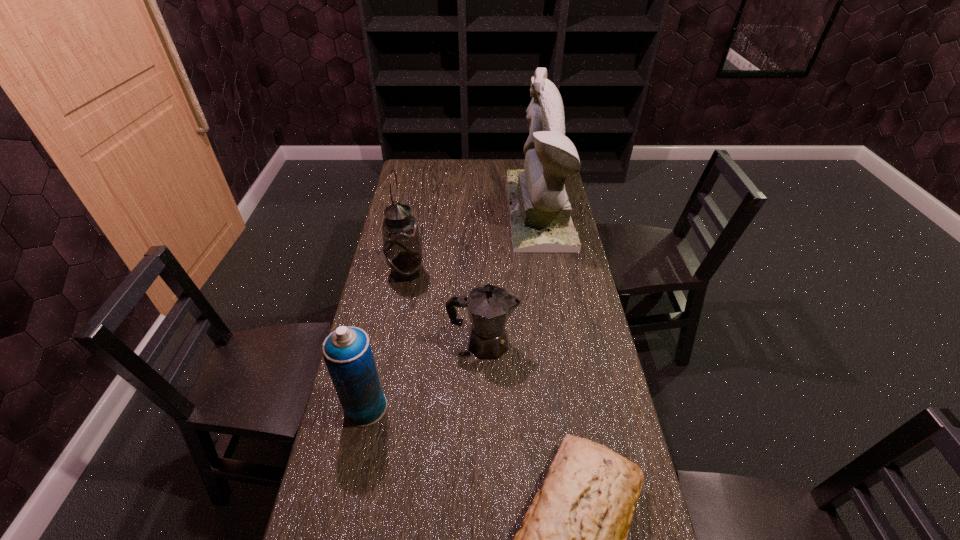
The height and width of the screenshot is (540, 960). I want to click on vacant point located on the base of the tallest object, so click(440, 210).

You are a GUI agent. You are given a task and a screenshot of the screen. Output one action in this format:
    pyautogui.click(x=<x>, y=<y>)
    Task: Click on the vacant area situated 0.210m on the back of the second farthest object
    This screenshot has width=960, height=540.
    Given the screenshot: What is the action you would take?
    pyautogui.click(x=414, y=226)

Identify the location of vacant space positioned 0.190m on the front of the second nearest object. This screenshot has width=960, height=540. (346, 504).

Where is `vacant region located 0.100m on the pouring side of the second shortest object`? Image resolution: width=960 pixels, height=540 pixels. vacant region located 0.100m on the pouring side of the second shortest object is located at coordinates (551, 343).

Locate an element on the screen. The width and height of the screenshot is (960, 540). object positioned at the far edge is located at coordinates (540, 212).

At what (x,y) coordinates should I click in order to perform the action: click on oil lamp located in the left edge section of the desktop. Please return your answer as a coordinate pair (x, y). This screenshot has height=540, width=960. Looking at the image, I should click on (401, 246).

You are a GUI agent. You are given a task and a screenshot of the screen. Output one action in this format:
    pyautogui.click(x=<x>, y=<y>)
    Task: Click on the aerosol can that is at the left edge
    
    Given the screenshot: What is the action you would take?
    pyautogui.click(x=347, y=353)

Locate an element on the screen. object that is at the right edge is located at coordinates (540, 212).

At what (x,y) coordinates should I click in order to perform the action: click on object that is at the far right corner. Please return your answer as a coordinate pair (x, y). Looking at the image, I should click on (540, 212).

The width and height of the screenshot is (960, 540). In the image, there is a desktop. What are the coordinates of `vacant space at the far edge` in the screenshot? It's located at (443, 161).